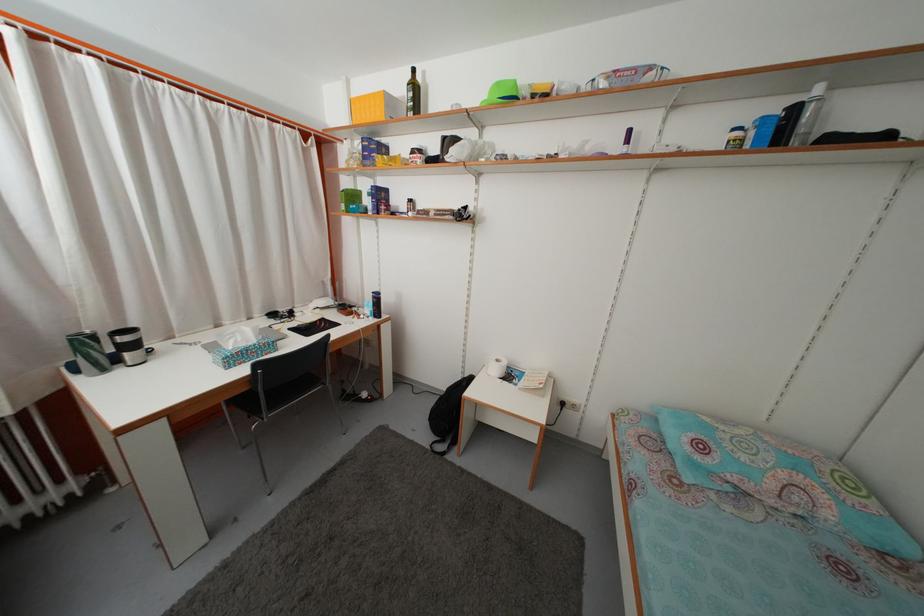
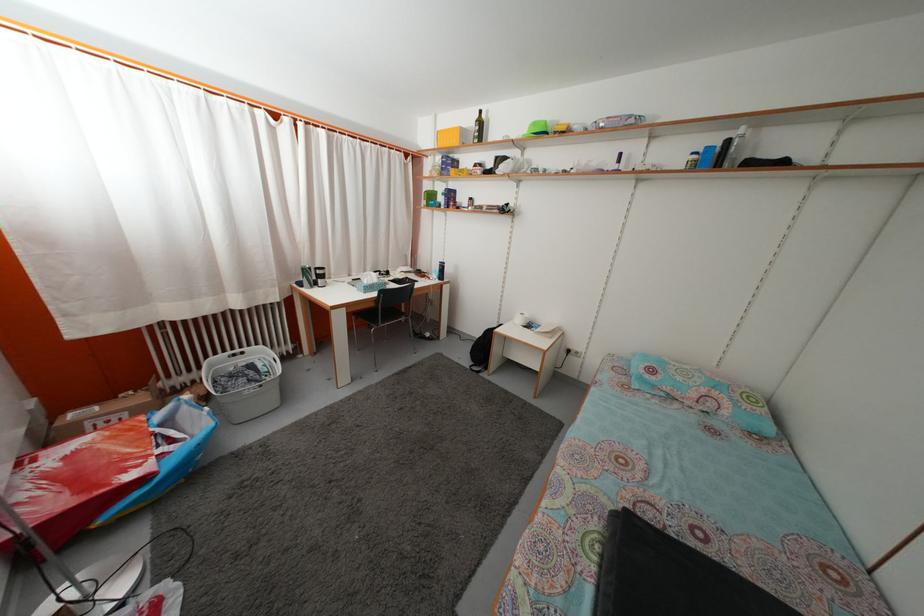
Where in the second image is the point corresponding to (99,344) from the first image?

(315, 276)